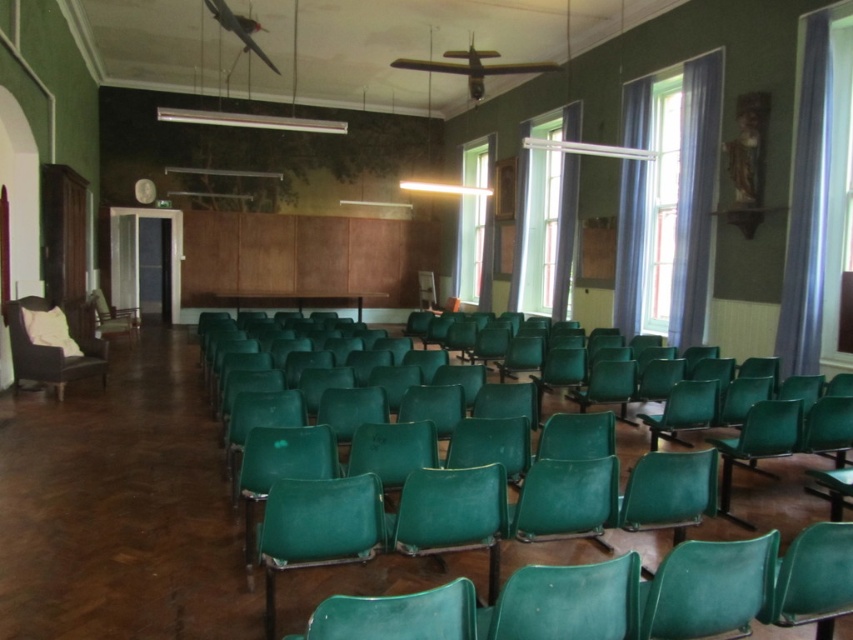
You are standing at the entrance of the room and want to sit down. Which chair, the matte green armchair at center or the green plastic chair at left, is closer to you?

The matte green armchair at center is closer to you than the green plastic chair at left.

You are standing at the entrance of the room and want to sit in one of the armchairs. Which armchair, the matte green armchair at center or the velvet brown armchair at left, is closer to you?

The matte green armchair at center is closer to you because it is in front of the velvet brown armchair at left.

You are standing in the room and want to take a photo of the matte green armchair at center. You have a camera that has a maximum focus range of 10 feet. Can you take the photo without moving closer?

The matte green armchair at center and camera are 9.72 feet apart from each other. Since the camera can focus up to 10 feet, you can take the photo without moving closer.